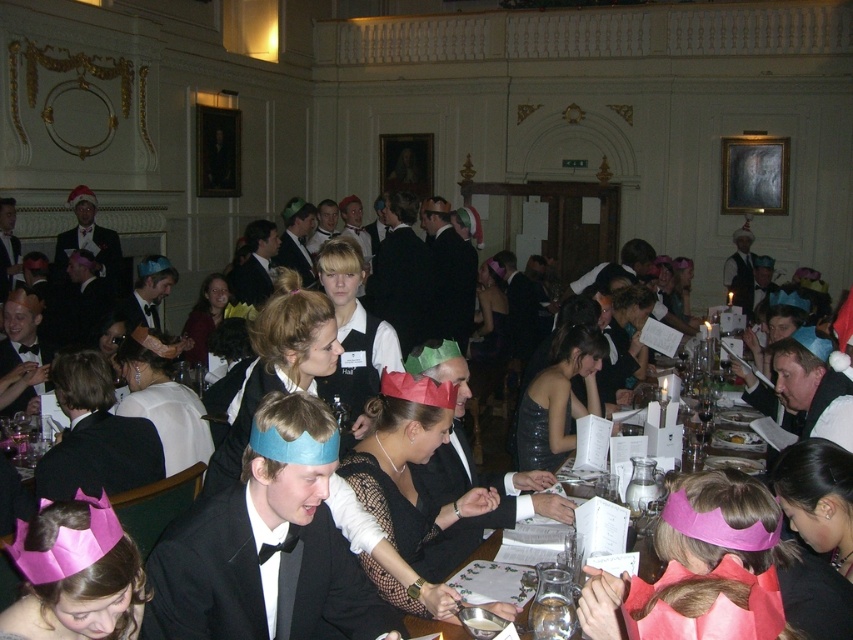
Is point (103, 529) positioned in front of point (445, 451)?

Yes, point (103, 529) is closer to viewer.

I want to click on pink paper crown at lower left, so click(x=74, y=573).